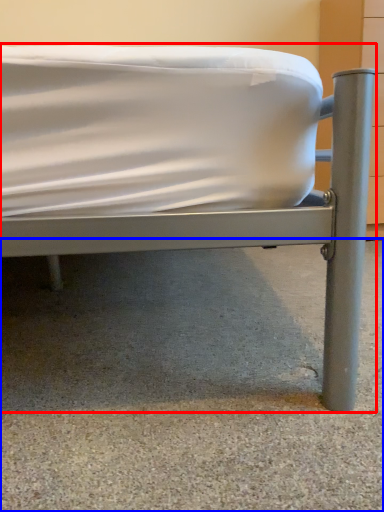
Question: Which object is further to the camera taking this photo, bed (highlighted by a red box) or concrete (highlighted by a blue box)?

Choices:
 (A) bed
 (B) concrete

Answer: (B)